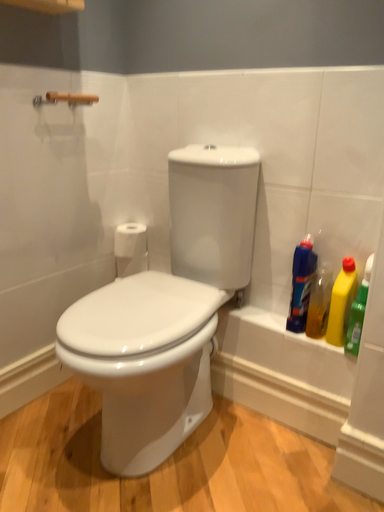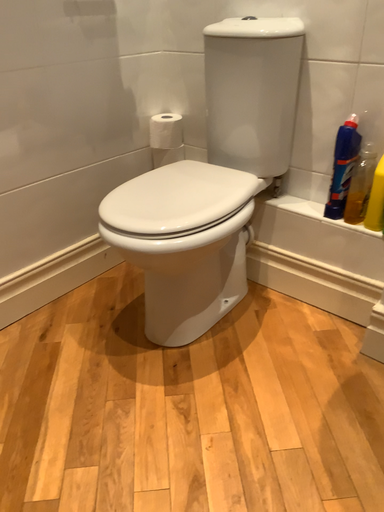
Question: How did the camera likely rotate when shooting the video?

Choices:
 (A) rotated downward
 (B) rotated upward

Answer: (A)